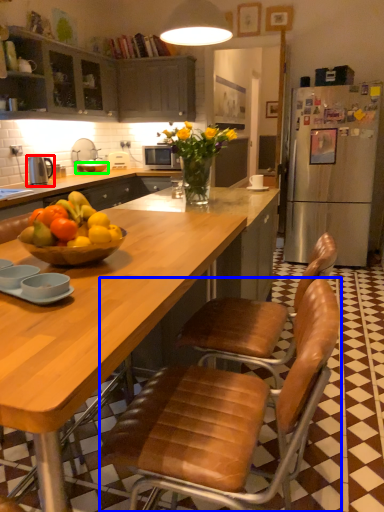
Question: Considering the real-world distances, which object is closest to kitchen appliance (highlighted by a red box)? chair (highlighted by a blue box) or bowl (highlighted by a green box).

Choices:
 (A) chair
 (B) bowl

Answer: (B)